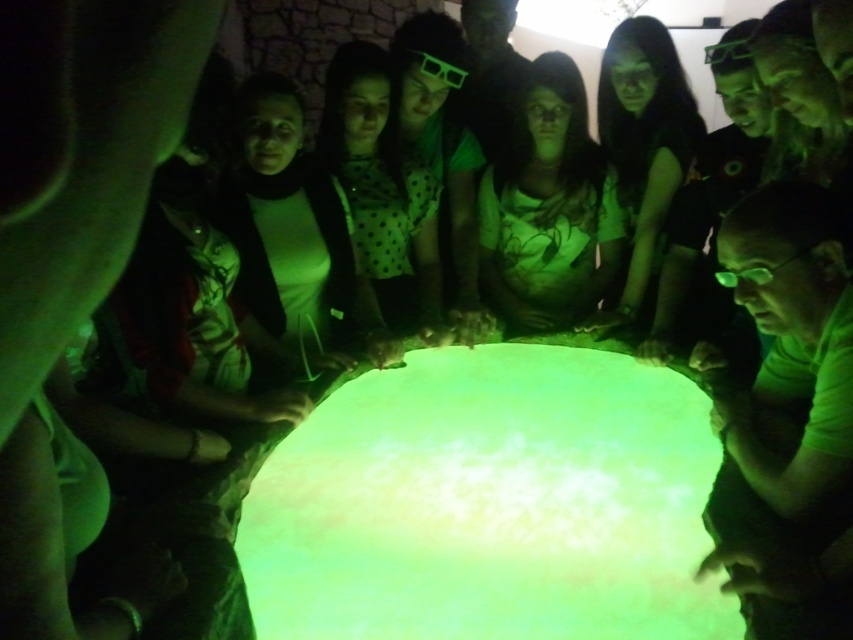
Is green glowing surface at center smaller than white matte shirt at center?

Actually, green glowing surface at center might be larger than white matte shirt at center.

Is green glowing surface at center closer to camera compared to white matte shirt at center?

Yes, it is.

At what (x,y) coordinates should I click in order to perform the action: click on green glowing surface at center. Please return your answer as a coordinate pair (x, y). The height and width of the screenshot is (640, 853). Looking at the image, I should click on (489, 502).